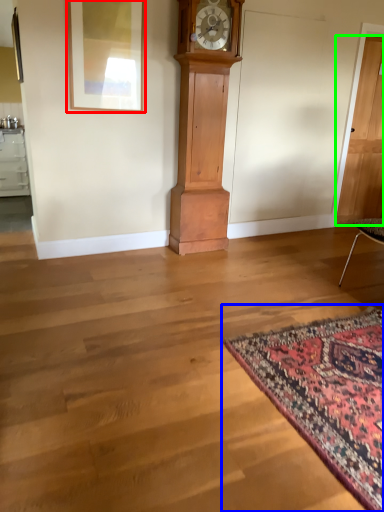
Question: Based on their relative distances, which object is farther from picture frame (highlighted by a red box)? Choose from mat (highlighted by a blue box) and door (highlighted by a green box).

Choices:
 (A) mat
 (B) door

Answer: (B)